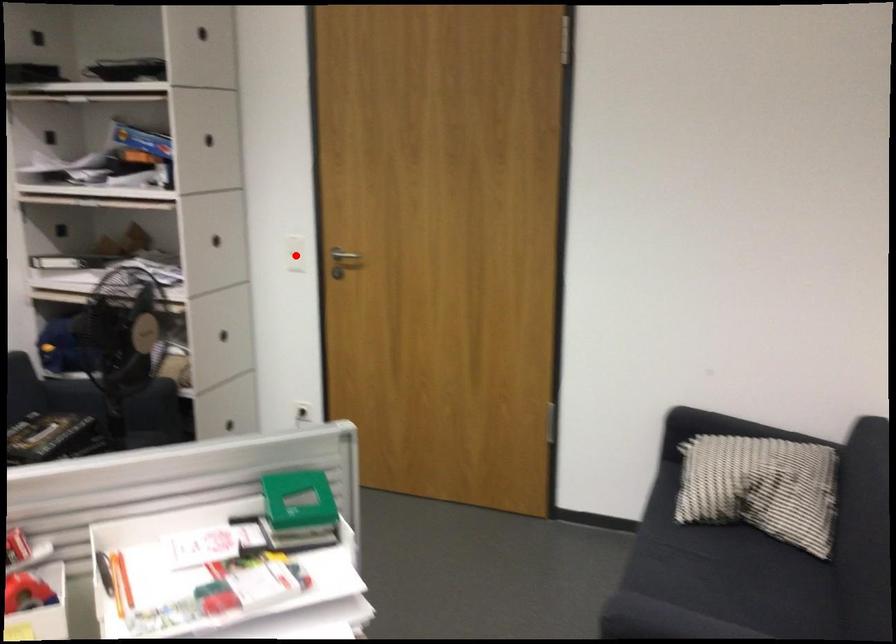
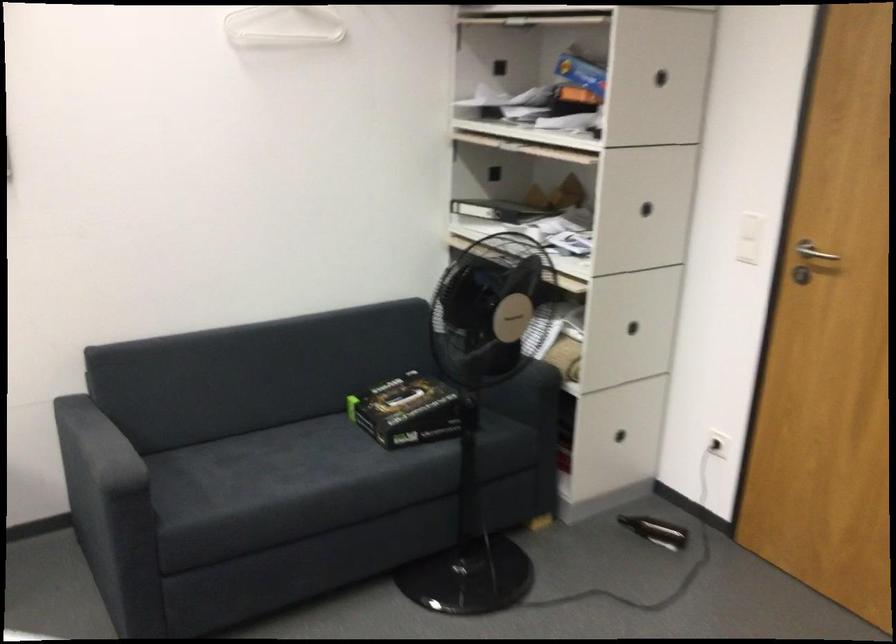
Question: I am providing you with two images of the same scene from different viewpoints. A red point is shown in image1. For the corresponding object point in image2, is it positioned nearer or farther from the camera?

Choices:
 (A) Nearer
 (B) Farther

Answer: (A)